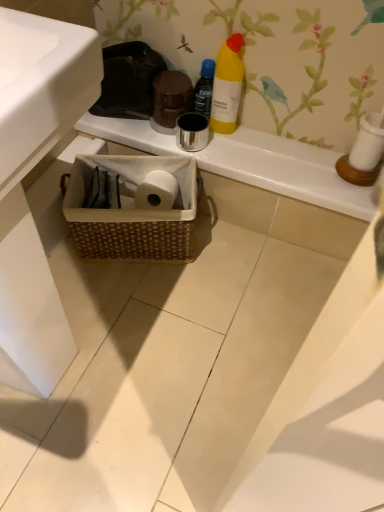
Locate an element on the screen. vacant area located to the right-hand side of woven brown basket at lower center is located at coordinates (234, 258).